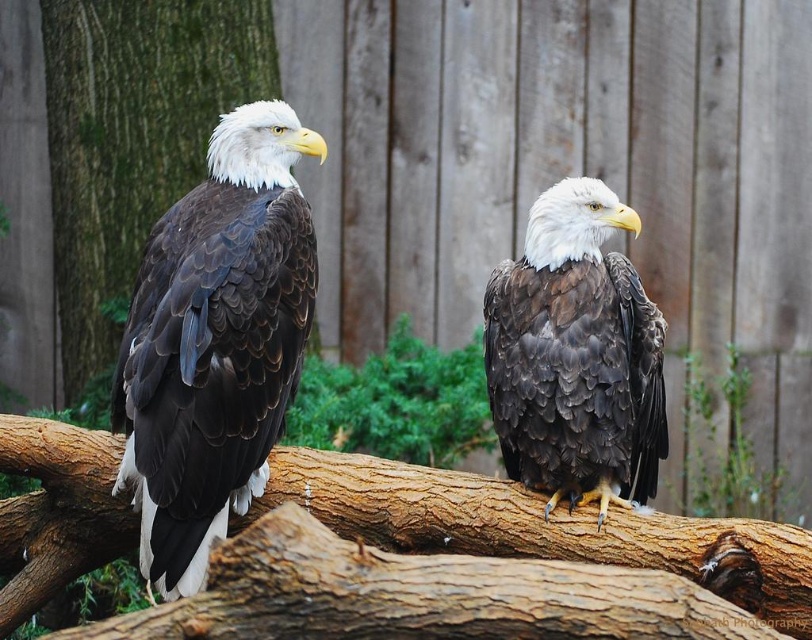
You are standing in front of the bald eagles enclosure and want to take a photo of the point at coordinate point (234, 349). The camera you have can focus on objects up to 4 meters away. Will the point be in focus?

The point at coordinate point (234, 349) is 3.83 meters from the camera, which is within the camera focus range of up to 4 meters. Therefore, the point will be in focus.

You are a zookeeper planning to place a new feeding tray on the brown rough wood at center and the green bark tree at left. Which surface can accommodate a larger feeding tray based on their sizes?

The green bark tree at left can accommodate a larger feeding tray since it has a bigger size compared to the brown rough wood at center.

Consider the image. You are a zookeeper observing two bald eagles in their enclosure. You notice the dark brown feathers at left and the brown rough wood at center. Which object is located more to the left?

The dark brown feathers at left is positioned on the left side of brown rough wood at center, so it is more to the left.